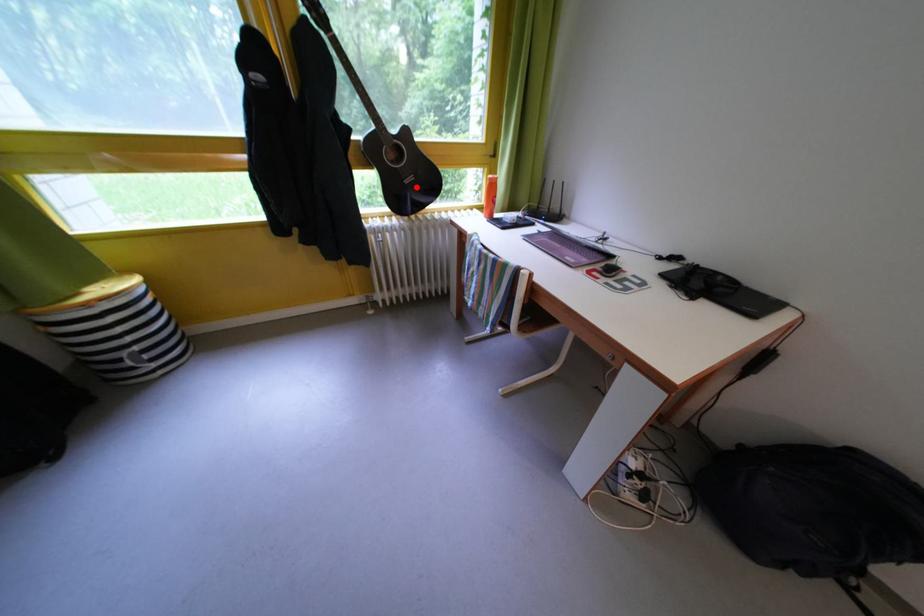
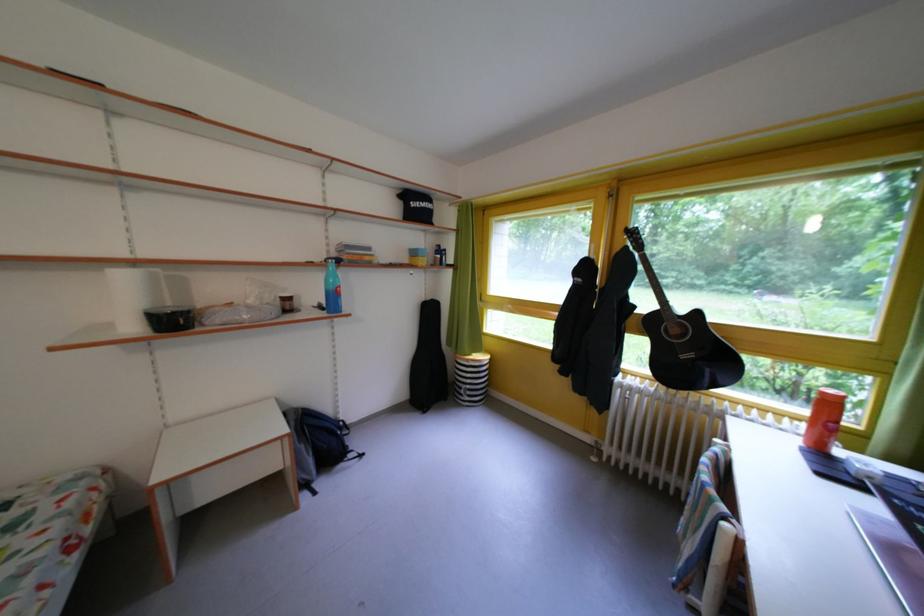
Locate, in the second image, the point that corresponds to the highlighted location in the first image.

(693, 362)